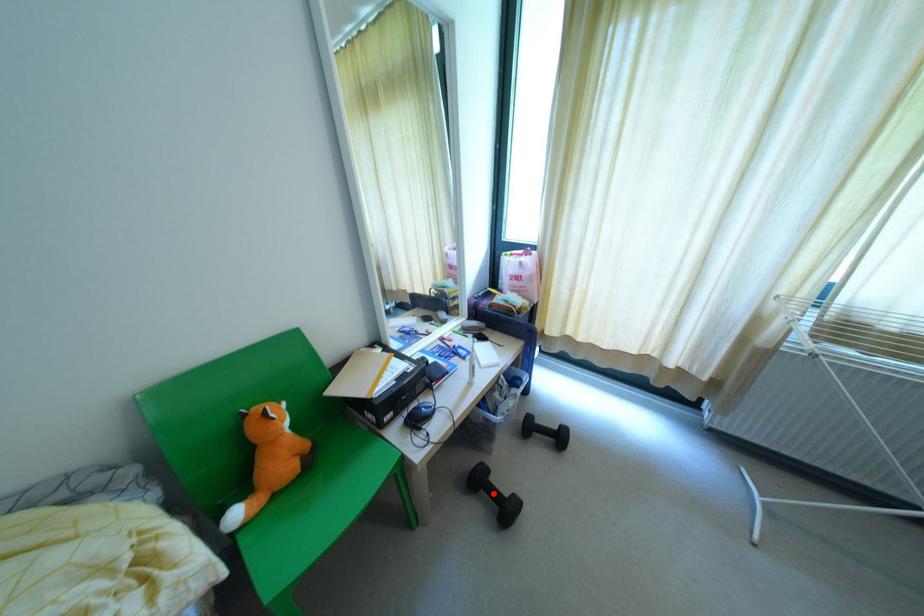
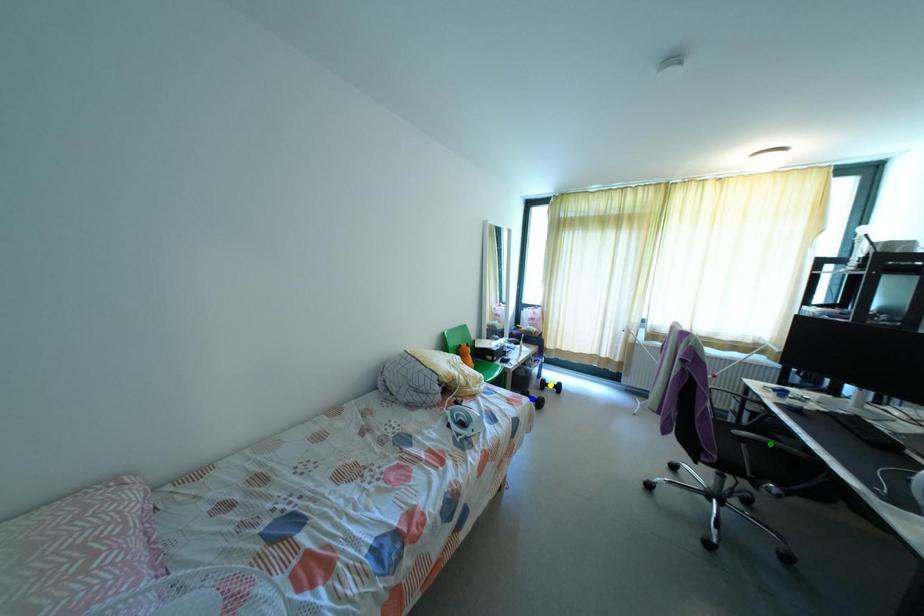
Question: I am providing you with two images of the same scene from different viewpoints. A red point is marked on the first image. You are given multiple points on the second image. Which point in image 2 represents the same 3d spot as the red point in image 1?

Choices:
 (A) blue point
 (B) yellow point
 (C) green point

Answer: (A)